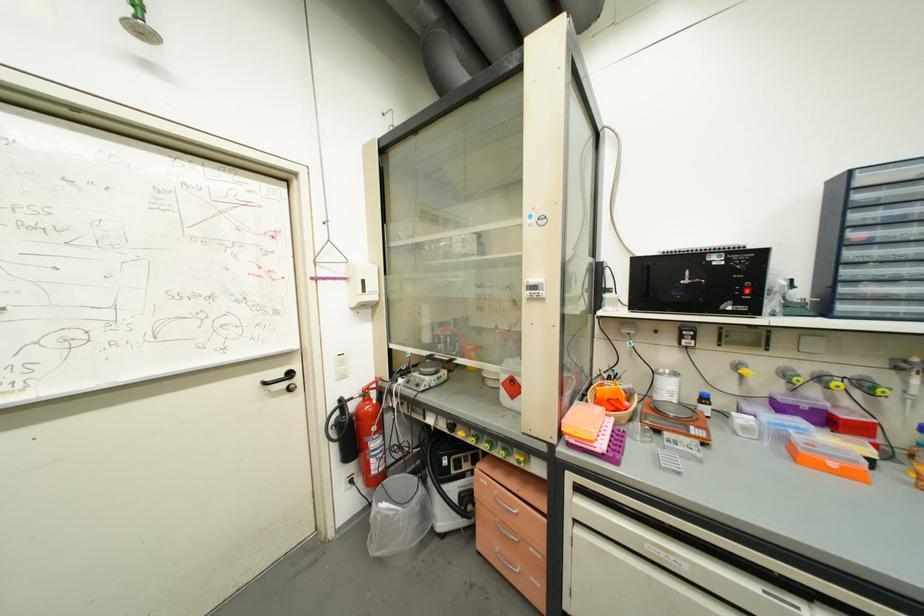
This screenshot has width=924, height=616. Find the location of `black machine knob`. black machine knob is located at coordinates (691, 285).